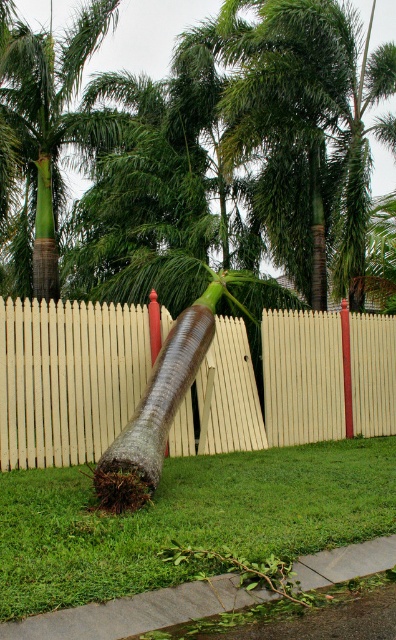
Which is behind, point (306, 426) or point (60, 620)?

Point (306, 426)

Is white wood fence at center closer to the viewer compared to gray concrete curb at lower center?

No, it is behind gray concrete curb at lower center.

Who is more forward, (137, 337) or (106, 634)?

Point (106, 634) is in front.

You are a GUI agent. You are given a task and a screenshot of the screen. Output one action in this format:
    pyautogui.click(x=<x>, y=<y>)
    Task: Click on the white wood fence at center
    
    Given the screenshot: What is the action you would take?
    pyautogui.click(x=68, y=378)

Does green matte palm tree at center appear under gray concrete curb at lower center?

No.

Does green matte palm tree at center appear over gray concrete curb at lower center?

Yes, green matte palm tree at center is above gray concrete curb at lower center.

The image size is (396, 640). Identify the location of green matte palm tree at center. (53, 115).

Between green grass at lower center and green matte palm tree at center, which one appears on the left side from the viewer's perspective?

green matte palm tree at center

The width and height of the screenshot is (396, 640). Identify the location of green grass at lower center. (188, 518).

Where is `green grass at lower center`? This screenshot has width=396, height=640. green grass at lower center is located at coordinates (188, 518).